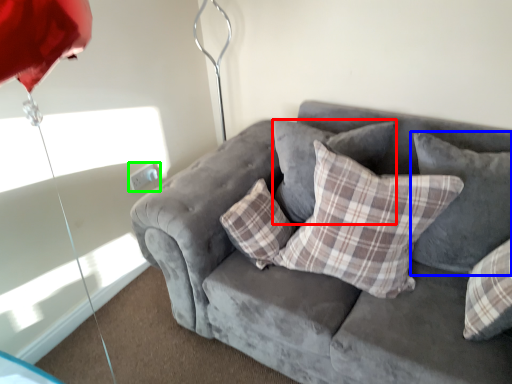
Question: Considering the real-world distances, which object is closest to pillow (highlighted by a red box)? pillow (highlighted by a blue box) or electric outlet (highlighted by a green box).

Choices:
 (A) pillow
 (B) electric outlet

Answer: (A)